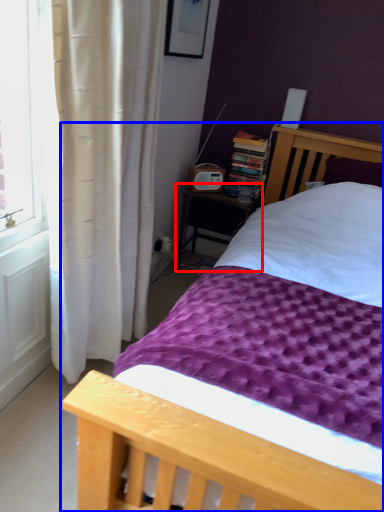
Question: Which point is further to the camera, nightstand (highlighted by a red box) or bed (highlighted by a blue box)?

Choices:
 (A) nightstand
 (B) bed

Answer: (A)